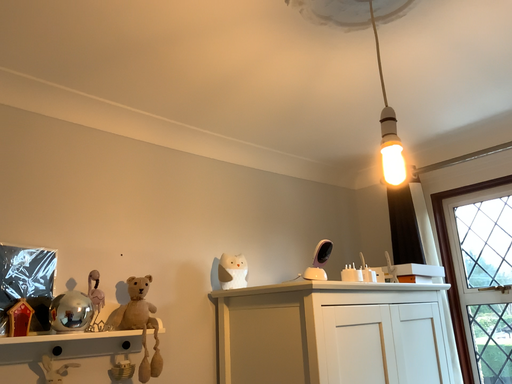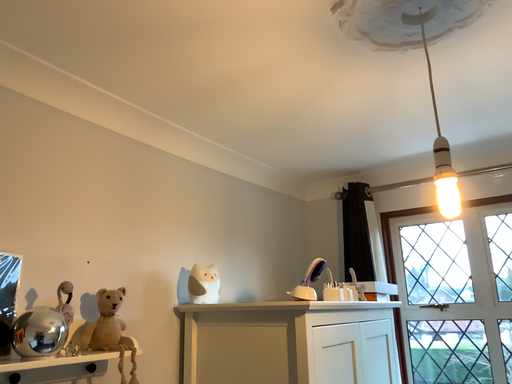
Question: Which way did the camera rotate in the video?

Choices:
 (A) rotated right
 (B) rotated left

Answer: (A)